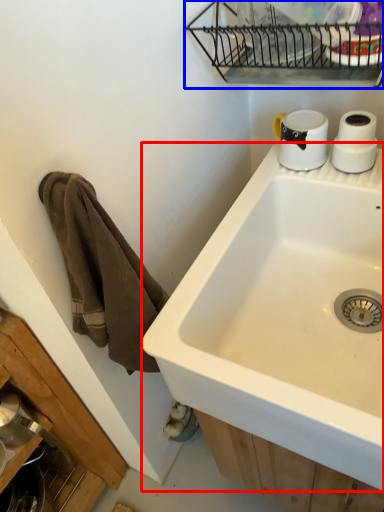
Question: Among these objects, which one is farthest to the camera, sink (highlighted by a red box) or appliance (highlighted by a blue box)?

Choices:
 (A) sink
 (B) appliance

Answer: (B)